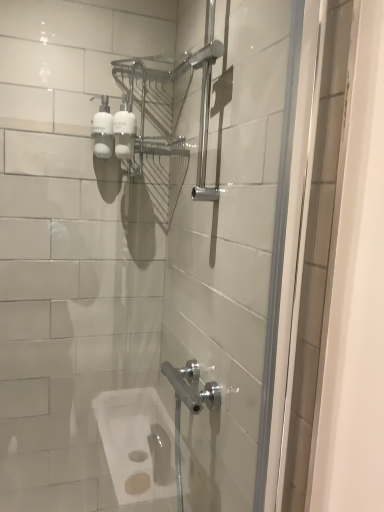
Question: Based on their sizes in the image, would you say white glossy pump bottles at upper left, the 2th toiletry viewed from the right, is bigger or smaller than white matte pump bottle at upper center, the 2th toiletry positioned from the left?

Choices:
 (A) small
 (B) big

Answer: (B)

Question: Is white glossy pump bottles at upper left, the 2th toiletry viewed from the right, spatially inside white matte pump bottle at upper center, the 1th toiletry from the right, or outside of it?

Choices:
 (A) inside
 (B) outside

Answer: (B)

Question: Is point (107, 101) closer or farther from the camera than point (122, 142)?

Choices:
 (A) closer
 (B) farther

Answer: (A)

Question: Considering the positions of point (125, 105) and point (107, 115), is point (125, 105) closer or farther from the camera than point (107, 115)?

Choices:
 (A) farther
 (B) closer

Answer: (A)

Question: Is white matte pump bottle at upper center, the 2th toiletry positioned from the left, wider or thinner than white glossy pump bottles at upper left, the 1th toiletry from the left?

Choices:
 (A) wide
 (B) thin

Answer: (A)

Question: In the image, is white matte pump bottle at upper center, the 1th toiletry from the right, positioned in front of or behind white glossy pump bottles at upper left, the 2th toiletry viewed from the right?

Choices:
 (A) behind
 (B) front

Answer: (B)

Question: Based on their sizes in the image, would you say white matte pump bottle at upper center, the 1th toiletry from the right, is bigger or smaller than white glossy pump bottles at upper left, the 1th toiletry from the left?

Choices:
 (A) small
 (B) big

Answer: (A)